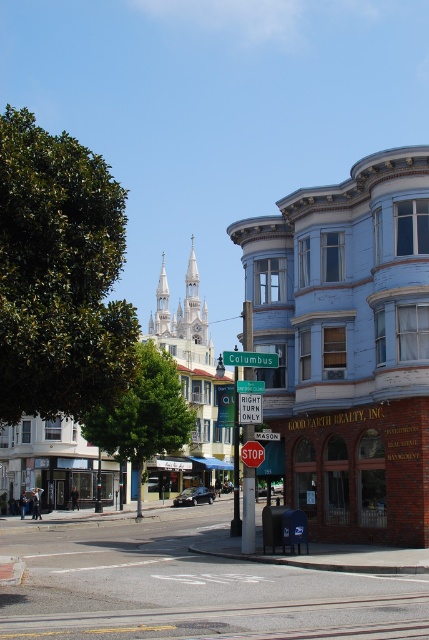
Which of these two, light blue wooden building at center or smooth asphalt road at center, stands shorter?

smooth asphalt road at center

Which is in front, point (274, 285) or point (123, 524)?

Point (274, 285)

At what (x,y) coordinates should I click in order to perform the action: click on light blue wooden building at center. Please return your answer as a coordinate pair (x, y). Looking at the image, I should click on (347, 348).